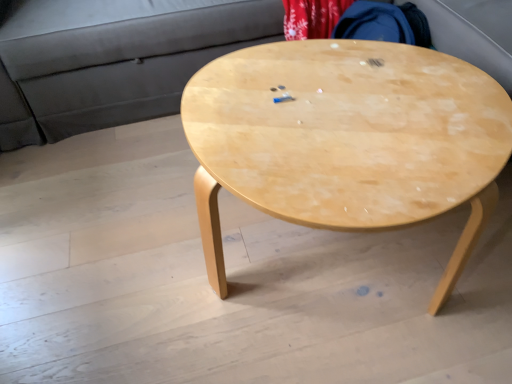
The width and height of the screenshot is (512, 384). What do you see at coordinates (347, 140) in the screenshot?
I see `light wood/texture coffee table at center` at bounding box center [347, 140].

Locate an element on the screen. light wood/texture coffee table at center is located at coordinates (347, 140).

Find the location of a particular element. This screenshot has width=512, height=384. light wood/texture coffee table at center is located at coordinates (347, 140).